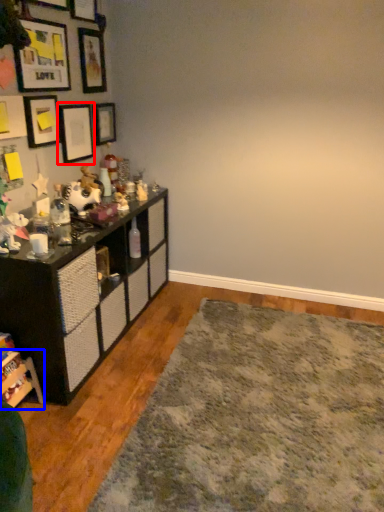
Question: Which point is closer to the camera, picture frame (highlighted by a red box) or shelf (highlighted by a blue box)?

Choices:
 (A) picture frame
 (B) shelf

Answer: (B)